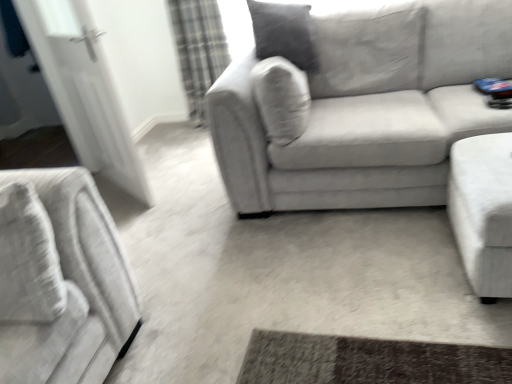
Question: From a real-world perspective, is velvet gray couch at center, acting as the first studio couch starting from the left, under white glossy door at left?

Choices:
 (A) no
 (B) yes

Answer: (B)

Question: From a real-world perspective, does velvet gray couch at center, acting as the first studio couch starting from the left, stand above white glossy door at left?

Choices:
 (A) yes
 (B) no

Answer: (B)

Question: Is velvet gray couch at center, which is the second studio couch from right to left, further to camera compared to white glossy door at left?

Choices:
 (A) yes
 (B) no

Answer: (B)

Question: Does velvet gray couch at center, which is the second studio couch from right to left, have a greater height compared to white glossy door at left?

Choices:
 (A) no
 (B) yes

Answer: (A)

Question: Considering the relative sizes of velvet gray couch at center, acting as the first studio couch starting from the left, and white glossy door at left in the image provided, is velvet gray couch at center, acting as the first studio couch starting from the left, shorter than white glossy door at left?

Choices:
 (A) yes
 (B) no

Answer: (A)

Question: From the image's perspective, does velvet gray couch at center, which is the second studio couch from right to left, appear higher than white glossy door at left?

Choices:
 (A) yes
 (B) no

Answer: (B)

Question: Considering the relative sizes of plaid fabric curtain at upper left and white fabric ottoman at right, arranged as the 1th studio couch when viewed from the right, in the image provided, is plaid fabric curtain at upper left shorter than white fabric ottoman at right, arranged as the 1th studio couch when viewed from the right,?

Choices:
 (A) no
 (B) yes

Answer: (A)

Question: Can you confirm if plaid fabric curtain at upper left is wider than white fabric ottoman at right, arranged as the 1th studio couch when viewed from the right?

Choices:
 (A) no
 (B) yes

Answer: (A)

Question: From the image's perspective, is plaid fabric curtain at upper left below white fabric ottoman at right, which is counted as the second studio couch, starting from the left?

Choices:
 (A) no
 (B) yes

Answer: (A)

Question: Is plaid fabric curtain at upper left facing towards white fabric ottoman at right, which is counted as the second studio couch, starting from the left?

Choices:
 (A) no
 (B) yes

Answer: (A)

Question: Is white fabric ottoman at right, arranged as the 1th studio couch when viewed from the right, surrounded by plaid fabric curtain at upper left?

Choices:
 (A) yes
 (B) no

Answer: (B)

Question: Is plaid fabric curtain at upper left outside of white fabric ottoman at right, which is counted as the second studio couch, starting from the left?

Choices:
 (A) no
 (B) yes

Answer: (B)

Question: Is velvet gray couch at center, which is the second studio couch from right to left, positioned before white fabric ottoman at right, which is counted as the second studio couch, starting from the left?

Choices:
 (A) no
 (B) yes

Answer: (A)